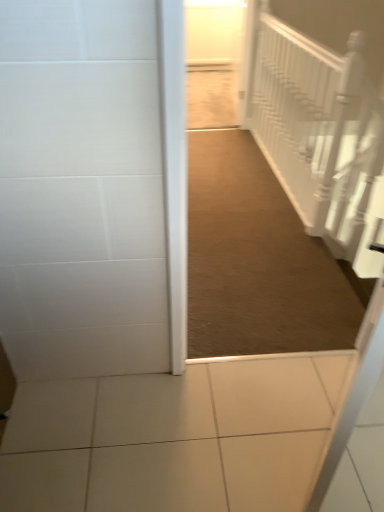
Locate an element on the screen. free spot in front of white textured stairwell at upper right is located at coordinates (257, 231).